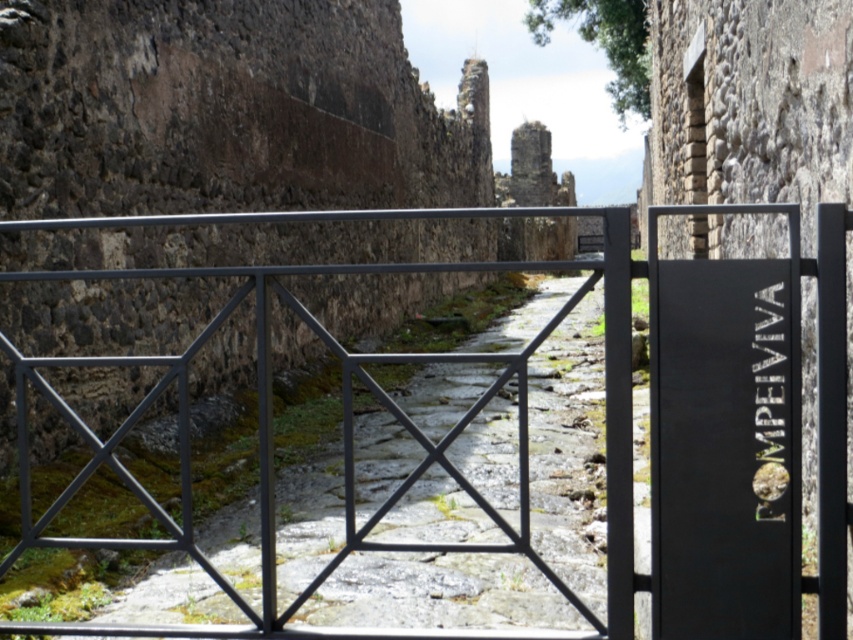
Question: In this image, where is black metal gate at center located relative to black matte sign at right?

Choices:
 (A) below
 (B) above

Answer: (B)

Question: Considering the relative positions of black metal gate at center and black matte sign at right in the image provided, where is black metal gate at center located with respect to black matte sign at right?

Choices:
 (A) left
 (B) right

Answer: (A)

Question: Which point is farther from the camera taking this photo?

Choices:
 (A) (715, 486)
 (B) (821, 387)

Answer: (A)

Question: Is black metal gate at center positioned before black matte sign at right?

Choices:
 (A) yes
 (B) no

Answer: (A)

Question: Among these points, which one is farthest from the camera?

Choices:
 (A) (676, 493)
 (B) (262, 269)

Answer: (B)

Question: Which object appears closest to the camera in this image?

Choices:
 (A) black metal gate at center
 (B) black matte sign at right

Answer: (A)